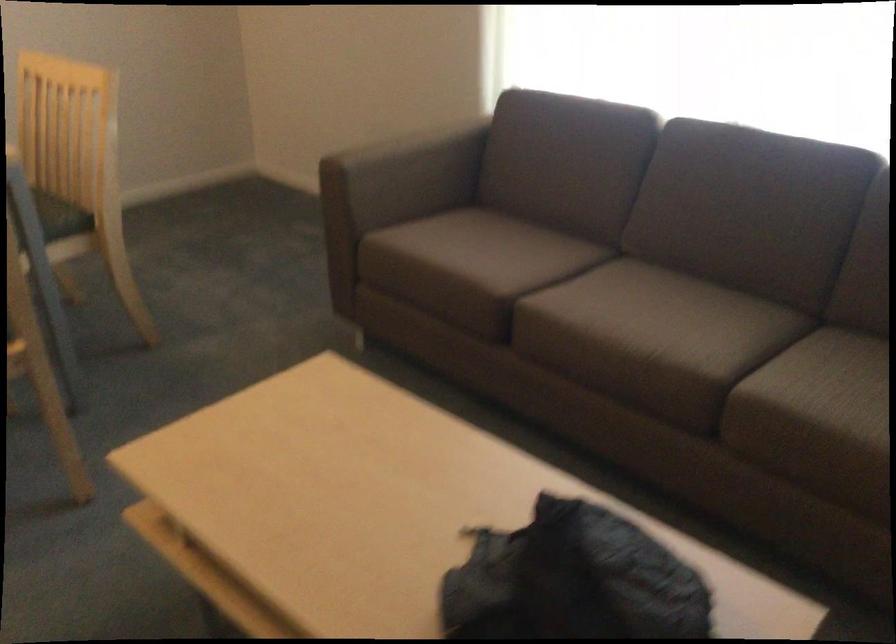
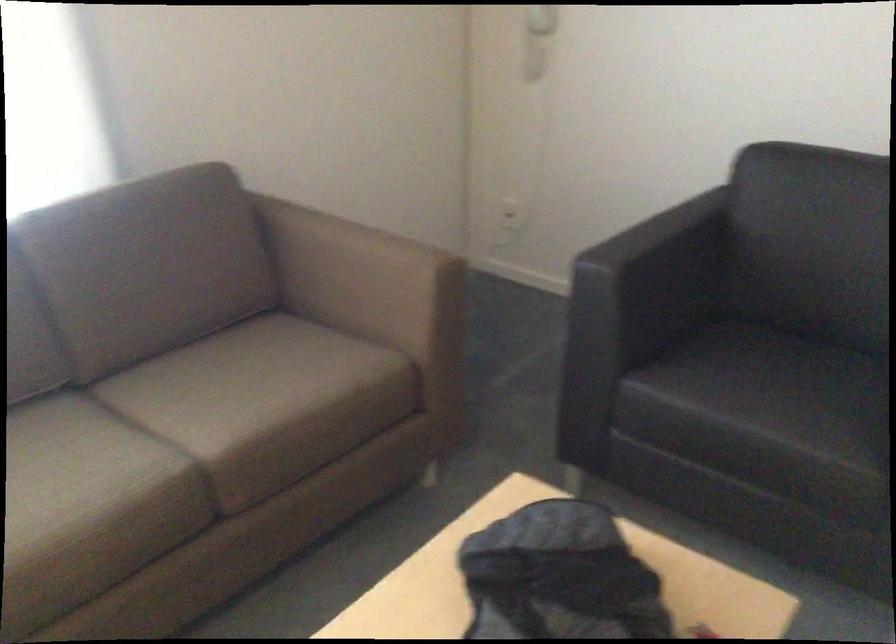
The point at (x=711, y=365) is marked in the first image. Where is the corresponding point in the second image?

(179, 451)